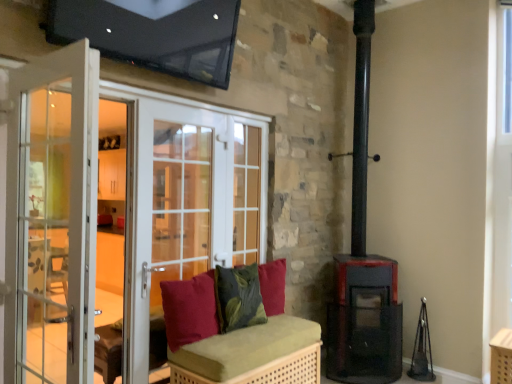
Question: Considering the positions of matte black stove at lower right and green textured cushion at center, which ranks as the second pillow in back-to-front order, in the image, is matte black stove at lower right bigger or smaller than green textured cushion at center, which ranks as the second pillow in back-to-front order,?

Choices:
 (A) small
 (B) big

Answer: (B)

Question: Relative to green textured cushion at center, which is the second pillow from front to back, is matte black stove at lower right in front or behind?

Choices:
 (A) front
 (B) behind

Answer: (B)

Question: Which is nearer to the green woven bench at center?

Choices:
 (A) white glass screen door at center, positioned as the 1th screen door in back-to-front order
 (B) matte black stove at lower right
 (C) green textured cushion at center, which ranks as the second pillow in back-to-front order
 (D) white glass screen door at left, the first screen door in the front-to-back sequence
 (E) velvet red cushion at center, which ranks as the 3th pillow in back-to-front order

Answer: (E)

Question: Which of these objects is positioned closest to the green woven bench at center?

Choices:
 (A) velvet red cushion at center, which is the first pillow from back to front
 (B) matte black stove at lower right
 (C) white glass screen door at left, the first screen door in the front-to-back sequence
 (D) velvet red cushion at center, the first pillow positioned from the front
 (E) white glass screen door at center, which ranks as the second screen door in front-to-back order

Answer: (D)